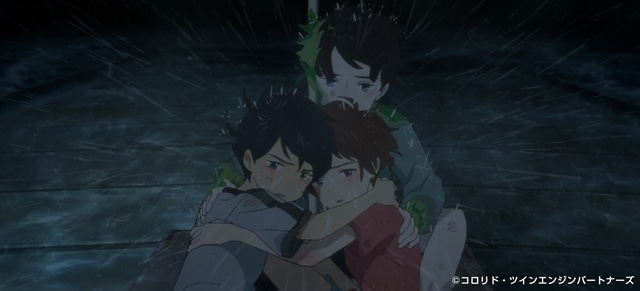
The height and width of the screenshot is (291, 640). Find the location of `left side wooden frame`. left side wooden frame is located at coordinates (164, 266).